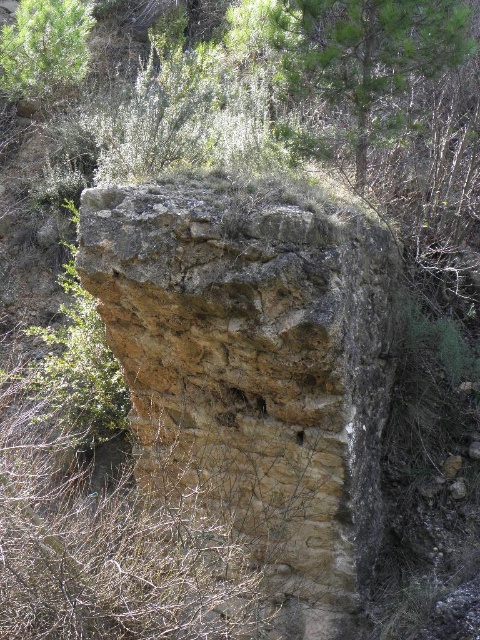
Does point (327, 355) come behind point (271, 22)?

No, it is not.

Does brown rough stone at center have a lesser height compared to green leafy tree at upper center?

No, brown rough stone at center is not shorter than green leafy tree at upper center.

Which is behind, point (211, 216) or point (414, 61)?

Point (414, 61)

Locate an element on the screen. Image resolution: width=480 pixels, height=640 pixels. brown rough stone at center is located at coordinates (255, 369).

Between point (346, 32) and point (0, 77), which one is positioned in front?

Positioned in front is point (346, 32).

Is point (364, 156) closer to viewer compared to point (75, 77)?

Yes, point (364, 156) is in front of point (75, 77).

At what (x,y) coordinates should I click in order to perform the action: click on green leafy tree at upper center. Please return your answer as a coordinate pair (x, y). This screenshot has width=480, height=640. Looking at the image, I should click on (367, 54).

Identify the location of brown rough stone at center. Image resolution: width=480 pixels, height=640 pixels. (255, 369).

In the scene shown: Who is more distant from viewer, (x=274, y=198) or (x=28, y=48)?

The point (x=28, y=48) is more distant.

I want to click on brown rough stone at center, so click(x=255, y=369).

The width and height of the screenshot is (480, 640). Identify the location of brown rough stone at center. coord(255,369).